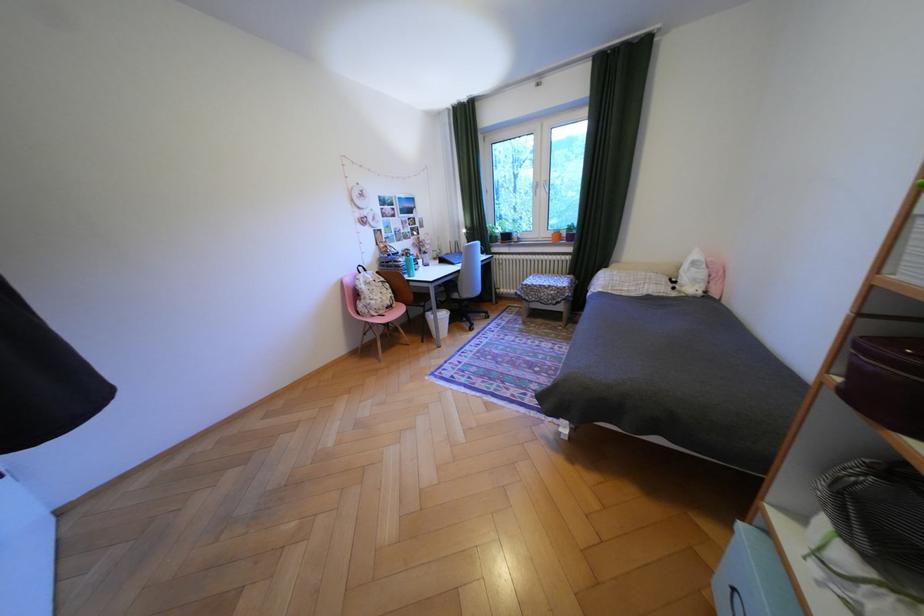
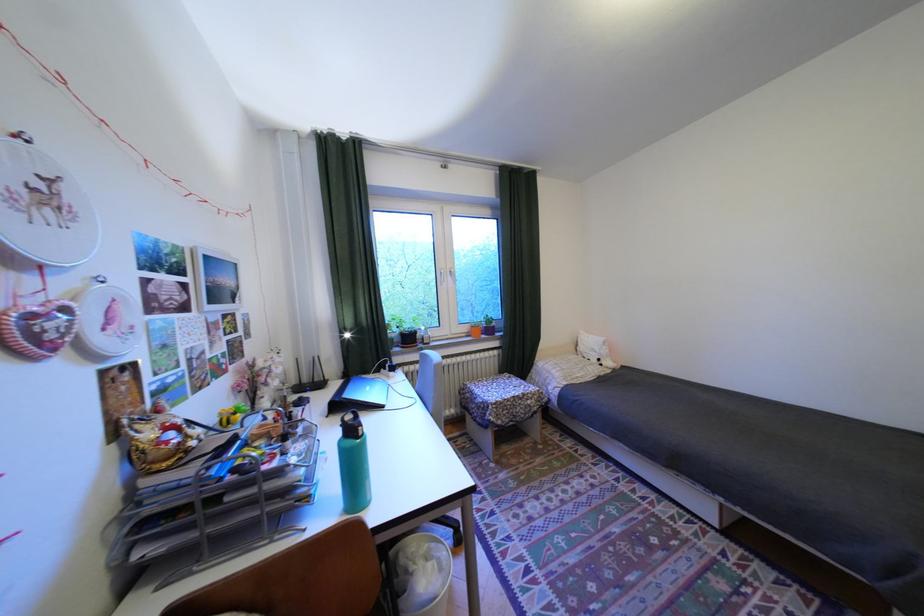
The point at (478, 228) is marked in the first image. Where is the corresponding point in the second image?

(354, 330)